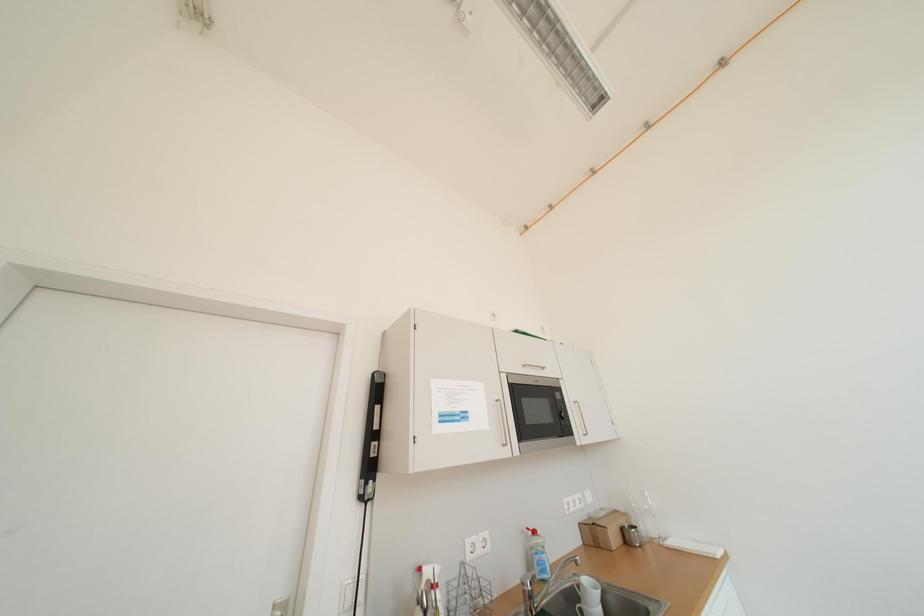
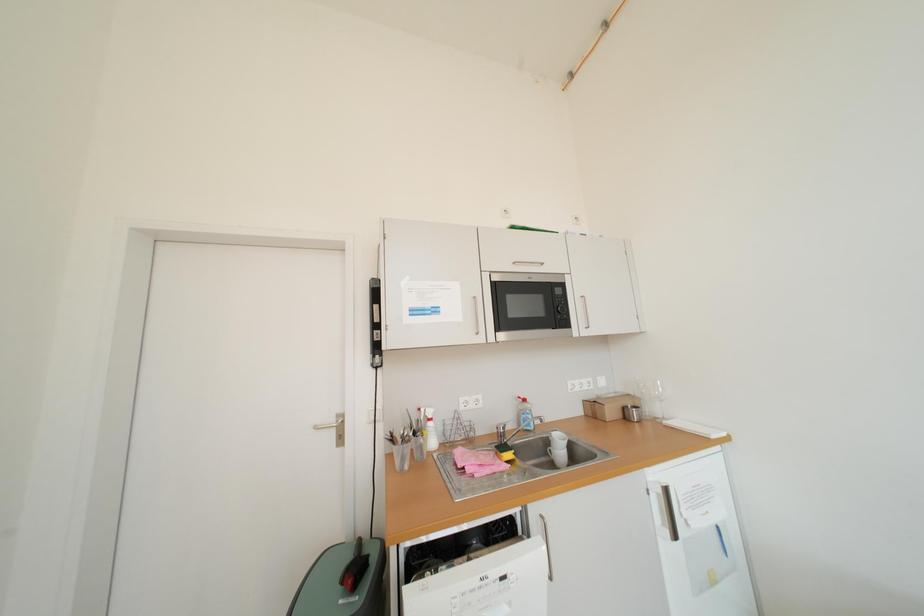
Question: Which direction would the cameraman need to move to produce the second image? Reply with the corresponding letter.

Choices:
 (A) Left
 (B) Right
 (C) Forward
 (D) Backward

Answer: (B)